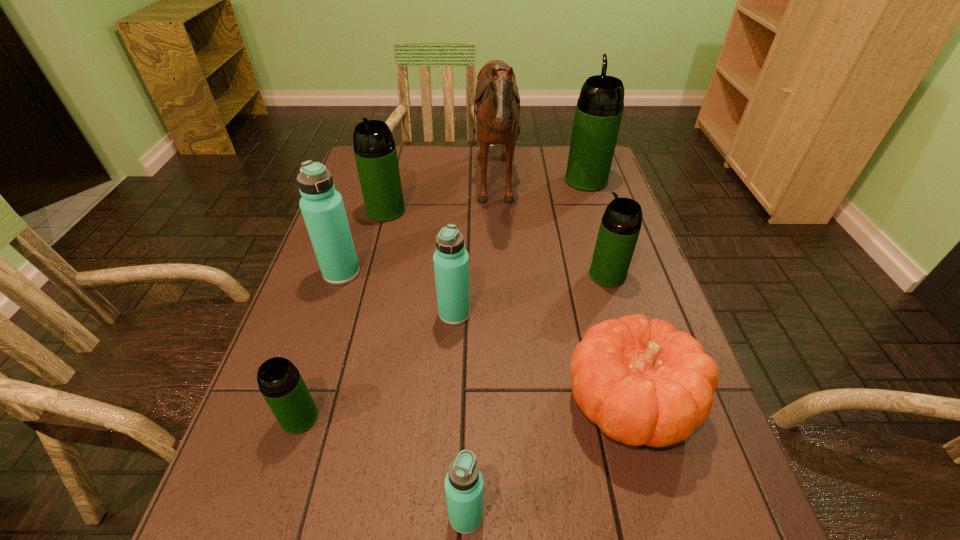
Locate an element on the screen. This screenshot has height=540, width=960. free spot between the second smallest aqua thermos bottle and the smallest green thermos bottle is located at coordinates (377, 366).

Locate an element on the screen. free space that is in between the second smallest green thermos bottle and the nearest aqua thermos bottle is located at coordinates (537, 395).

Where is `free space between the pumpkin and the second farthest aqua thermos bottle`? free space between the pumpkin and the second farthest aqua thermos bottle is located at coordinates (542, 358).

Find the location of a particular element. Image resolution: width=960 pixels, height=540 pixels. vacant space in between the smallest green thermos bottle and the pumpkin is located at coordinates (465, 410).

Where is `vacant space in between the farthest green thermos bottle and the biggest aqua thermos bottle`? This screenshot has height=540, width=960. vacant space in between the farthest green thermos bottle and the biggest aqua thermos bottle is located at coordinates pos(464,227).

You are a GUI agent. You are given a task and a screenshot of the screen. Output one action in this format:
    pyautogui.click(x=<x>, y=<y>)
    Task: Click on the free spot between the nearest object and the saddle
    The width and height of the screenshot is (960, 540).
    Given the screenshot: What is the action you would take?
    pyautogui.click(x=481, y=353)

Choose which object is the second nearest neighbor to the saddle. Please provide its 2D coordinates. Your answer should be formatted as a tuple, i.e. [(x, y)], where the tuple contains the x and y coordinates of a point satisfying the conditions above.

[(620, 226)]

Identify which object is the fourth closest to the third nearest green thermos bottle. Please provide its 2D coordinates. Your answer should be formatted as a tuple, i.e. [(x, y)], where the tuple contains the x and y coordinates of a point satisfying the conditions above.

[(599, 109)]

Locate which thermos bottle ranks sixth in proximity to the second nearest aqua thermos bottle. Please provide its 2D coordinates. Your answer should be formatted as a tuple, i.e. [(x, y)], where the tuple contains the x and y coordinates of a point satisfying the conditions above.

[(599, 109)]

In order to click on the fourth closest thermos bottle to the saddle in this screenshot , I will do `click(451, 260)`.